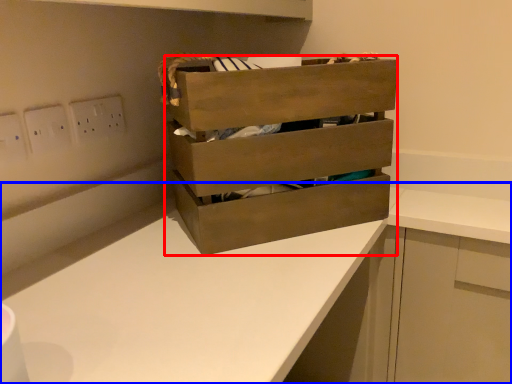
Question: Which object is closer to the camera taking this photo, chest of drawers (highlighted by a red box) or counter (highlighted by a blue box)?

Choices:
 (A) chest of drawers
 (B) counter

Answer: (B)